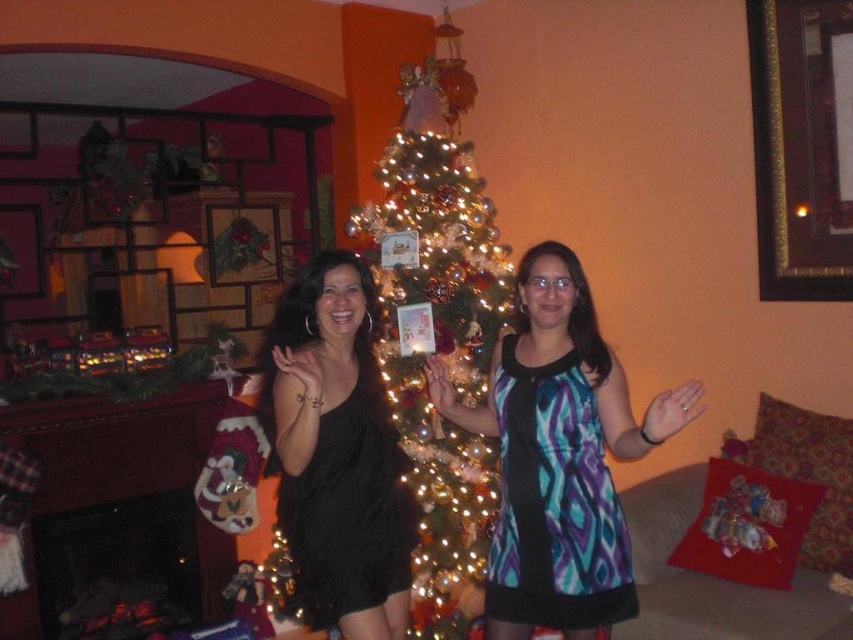
You are a photographer setting up for a holiday photo shoot in the living room. You have two models wearing the blue and white patterned dress at center and the black satin dress at center. The camera is positioned to capture both dresses equally in the frame. Since the dresses have different lengths, which dress will appear closer to the bottom edge of the photo?

The blue and white patterned dress at center is shorter than the black satin dress at center, so the hemline of the blue and white patterned dress at center will appear closer to the bottom edge of the photo.

You are organizing a photoshoot and need to ensure that the dresses in the scene are spaced appropriately. Given that the blue and white patterned dress at center is wider than the black satin dress at center, how should you adjust their positions to maintain a balanced composition?

Since the blue and white patterned dress at center is wider than the black satin dress at center, you should position the blue and white patterned dress at center slightly further back or reduce its width to balance the composition with the narrower black satin dress at center.

You are a photographer setting up for a Christmas photo shoot. You need to ensure that the iridescent glass Christmas tree at center and the black satin dress at center are both visible in the frame. Based on their sizes, which object should you focus on first to ensure proper framing?

The iridescent glass Christmas tree at center is taller than the black satin dress at center, so you should focus on framing the tree first to ensure its full height is captured, then adjust the frame to include the dress.